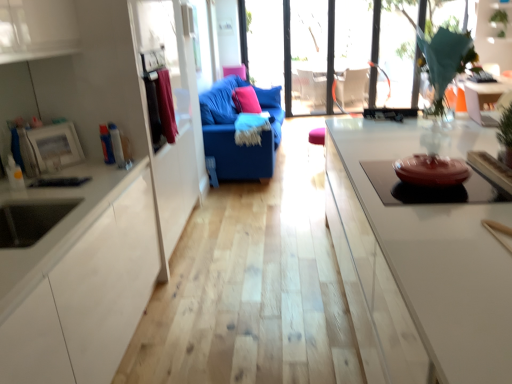
Question: From the image's perspective, is transparent glass window at upper center, positioned as the first window in left-to-right order, located above white glossy table at upper right?

Choices:
 (A) no
 (B) yes

Answer: (B)

Question: Would you say white glossy table at upper right is part of transparent glass window at upper center, acting as the 2th window starting from the right,'s contents?

Choices:
 (A) no
 (B) yes

Answer: (A)

Question: Does transparent glass window at upper center, acting as the 2th window starting from the right, lie in front of white glossy table at upper right?

Choices:
 (A) no
 (B) yes

Answer: (A)

Question: Considering the relative sizes of transparent glass window at upper center, acting as the 2th window starting from the right, and white glossy table at upper right in the image provided, is transparent glass window at upper center, acting as the 2th window starting from the right, taller than white glossy table at upper right?

Choices:
 (A) no
 (B) yes

Answer: (B)

Question: Is transparent glass window at upper center, positioned as the first window in left-to-right order, positioned far away from white glossy table at upper right?

Choices:
 (A) yes
 (B) no

Answer: (A)

Question: Is point (335, 26) closer or farther from the camera than point (257, 94)?

Choices:
 (A) farther
 (B) closer

Answer: (A)

Question: In terms of size, does transparent glass window at upper center, acting as the 2th window starting from the right, appear bigger or smaller than pink fabric pillow at center, the 1th pillow when ordered from back to front?

Choices:
 (A) big
 (B) small

Answer: (A)

Question: Considering their positions, is transparent glass window at upper center, acting as the 2th window starting from the right, located in front of or behind pink fabric pillow at center, the 1th pillow when ordered from back to front?

Choices:
 (A) behind
 (B) front

Answer: (A)

Question: Considering the positions of transparent glass window at upper center, positioned as the first window in left-to-right order, and pink fabric pillow at center, placed as the 2th pillow when sorted from front to back, in the image, is transparent glass window at upper center, positioned as the first window in left-to-right order, wider or thinner than pink fabric pillow at center, placed as the 2th pillow when sorted from front to back,?

Choices:
 (A) thin
 (B) wide

Answer: (A)

Question: From the image's perspective, is transparent glass door at center above or below green leafy plant at upper right?

Choices:
 (A) below
 (B) above

Answer: (A)

Question: Looking at their shapes, would you say transparent glass door at center is wider or thinner than green leafy plant at upper right?

Choices:
 (A) thin
 (B) wide

Answer: (A)

Question: From a real-world perspective, relative to green leafy plant at upper right, is transparent glass door at center vertically above or below?

Choices:
 (A) above
 (B) below

Answer: (B)

Question: Does point (317, 38) appear closer or farther from the camera than point (500, 19)?

Choices:
 (A) closer
 (B) farther

Answer: (B)

Question: In the image, is pink fabric pillow at center, the 1th pillow when ordered from back to front, positioned in front of or behind velvet blue sofa at center?

Choices:
 (A) behind
 (B) front

Answer: (A)

Question: Looking at their shapes, would you say pink fabric pillow at center, placed as the 2th pillow when sorted from front to back, is wider or thinner than velvet blue sofa at center?

Choices:
 (A) wide
 (B) thin

Answer: (B)